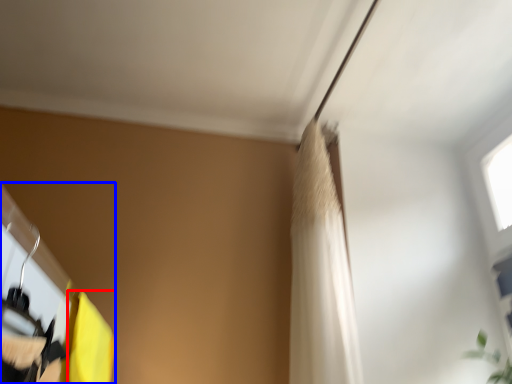
Question: Which of the following is the closest to the observer, curtain (highlighted by a red box) or closet (highlighted by a blue box)?

Choices:
 (A) curtain
 (B) closet

Answer: (B)